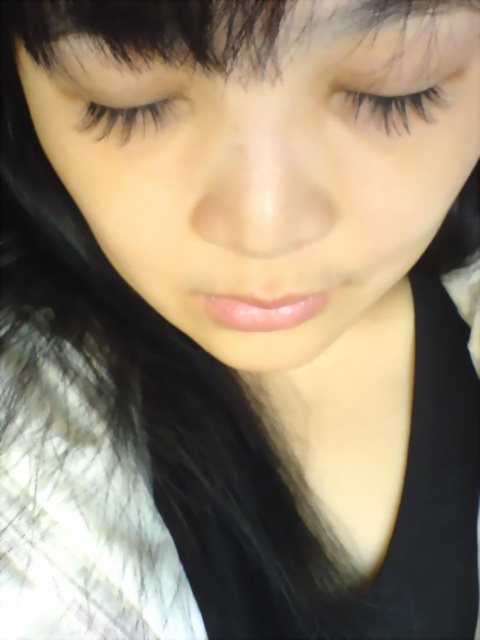
Between black matte hair at upper center and black eyelashes at upper center, which one has more height?

With more height is black matte hair at upper center.

Is black matte hair at upper center positioned before black eyelashes at upper center?

Yes, it is.

Which is behind, point (83, 6) or point (419, 93)?

The point (419, 93) is more distant.

Identify the location of black matte hair at upper center. The image size is (480, 640). (201, 26).

Which is more to the left, black matte hair at upper center or black eyelashes at upper left?

black eyelashes at upper left is more to the left.

Does black matte hair at upper center appear on the right side of black eyelashes at upper left?

Indeed, black matte hair at upper center is positioned on the right side of black eyelashes at upper left.

This screenshot has height=640, width=480. Find the location of `black matte hair at upper center`. black matte hair at upper center is located at coordinates (x=201, y=26).

Is smooth skin face at center shorter than black matte hair at upper center?

No, smooth skin face at center is not shorter than black matte hair at upper center.

Between point (471, 81) and point (56, 22), which one is positioned behind?

The point (471, 81) is more distant.

Where is `smooth skin face at center`? This screenshot has width=480, height=640. smooth skin face at center is located at coordinates (262, 154).